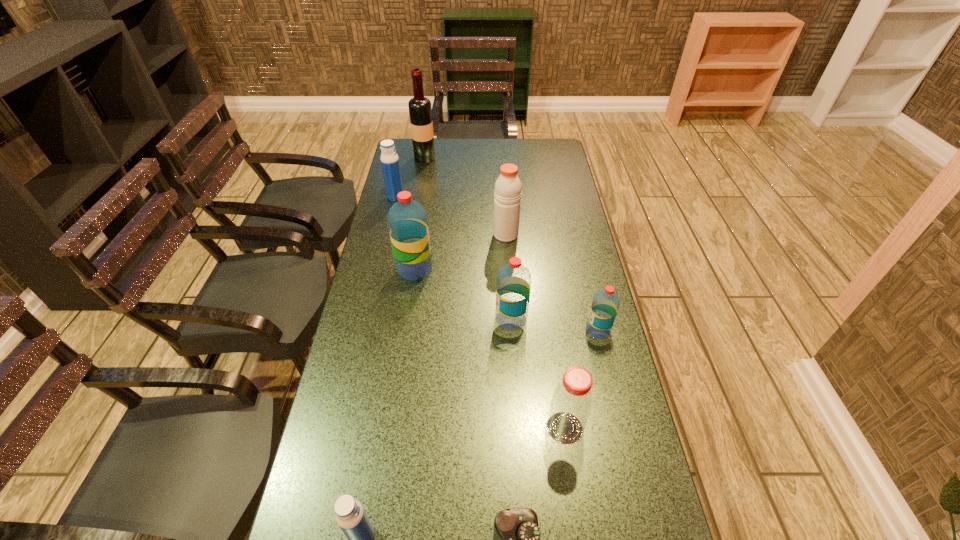
This screenshot has height=540, width=960. Identify the location of red bottle. (571, 403).

The height and width of the screenshot is (540, 960). Find the location of `the eighth object from left to right`. the eighth object from left to right is located at coordinates (571, 403).

Image resolution: width=960 pixels, height=540 pixels. I want to click on the smallest red water bottle, so click(x=605, y=304).

Locate an element on the screen. the rightmost object is located at coordinates (605, 304).

You are a GUI agent. You are given a task and a screenshot of the screen. Output one action in this format:
    pyautogui.click(x=<x>, y=<y>)
    Task: Click on the free space located 0.360m on the front of the wine bottle
    
    Given the screenshot: What is the action you would take?
    pyautogui.click(x=416, y=212)

Locate an element on the screen. vacant space located 0.070m on the front label of the sixth nearest object is located at coordinates (453, 269).

Identify the location of vacant region located on the right of the shaker. Image resolution: width=960 pixels, height=540 pixels. (565, 234).

The height and width of the screenshot is (540, 960). What are the coordinates of `blank space located 0.200m on the back of the farthest water bottle` in the screenshot? It's located at (402, 166).

Find the location of a particular element. Image resolution: width=960 pixels, height=540 pixels. free point located 0.310m on the front label of the fourth water bottle from left to right is located at coordinates (393, 319).

The height and width of the screenshot is (540, 960). I want to click on vacant point located 0.240m on the front label of the fourth water bottle from left to right, so click(416, 319).